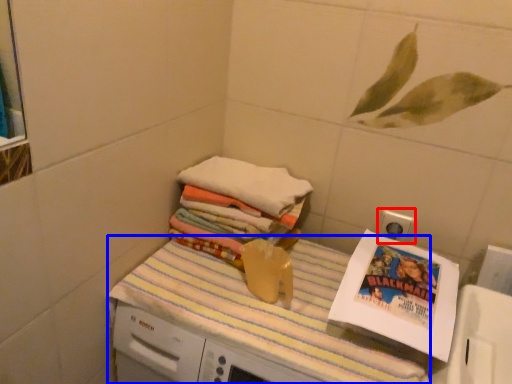
Question: Among these objects, which one is farthest to the camera, electric outlet (highlighted by a red box) or tablecloth (highlighted by a blue box)?

Choices:
 (A) electric outlet
 (B) tablecloth

Answer: (A)